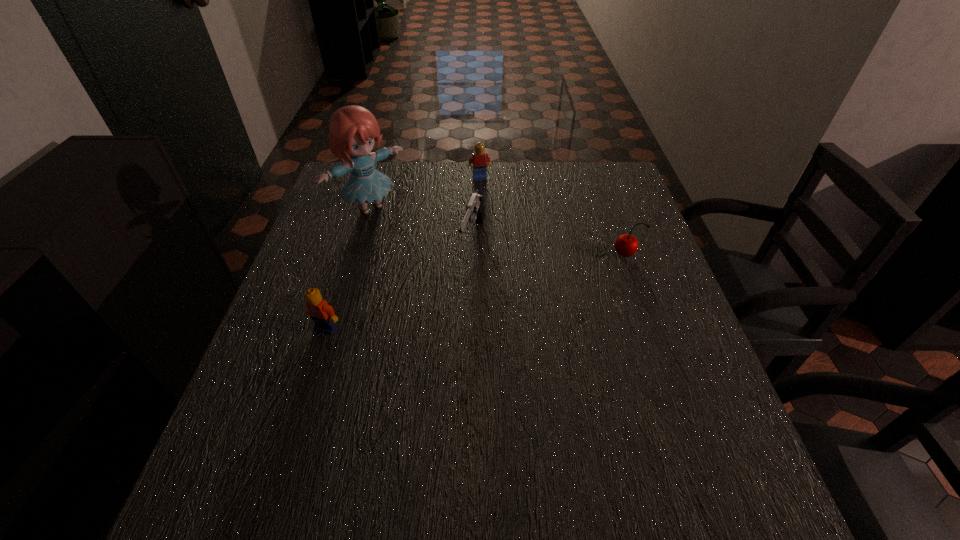
This screenshot has width=960, height=540. What are the coordinates of `vacant space on the desktop that is between the left Lego and the rightmost object and is positioned on the front-facing side of the farthest object` in the screenshot? It's located at (508, 284).

Where is `vacant space on the desktop that is between the nearer Lego and the rightmost object and is positioned at the muzzle of the gun`? Image resolution: width=960 pixels, height=540 pixels. vacant space on the desktop that is between the nearer Lego and the rightmost object and is positioned at the muzzle of the gun is located at coordinates (453, 298).

Where is `free spot on the desktop that is between the nearer Lego and the rightmost object and is positioned on the front-facing side of the tallest object`? This screenshot has height=540, width=960. free spot on the desktop that is between the nearer Lego and the rightmost object and is positioned on the front-facing side of the tallest object is located at coordinates (469, 293).